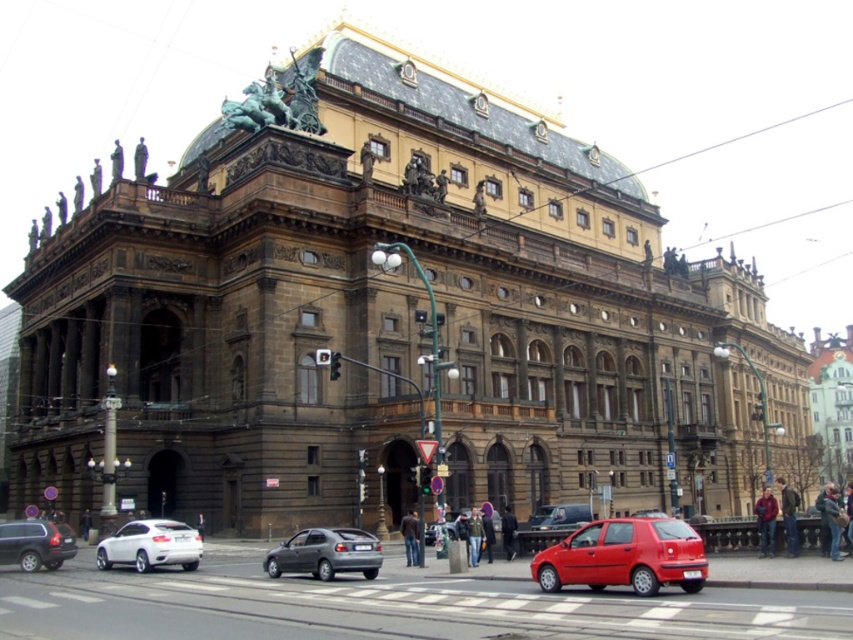
Question: Does matte black car at center appear under dark brown leather jacket at center?

Choices:
 (A) no
 (B) yes

Answer: (A)

Question: Which point is closer to the camera?

Choices:
 (A) click(x=67, y=536)
 (B) click(x=418, y=560)
 (C) click(x=544, y=563)

Answer: (C)

Question: Is matte black suv at lower left thinner than dark blue jacket at center?

Choices:
 (A) yes
 (B) no

Answer: (A)

Question: Observing the image, what is the correct spatial positioning of metallic gray hatchback at lower left in reference to dark brown leather jacket at center?

Choices:
 (A) left
 (B) right

Answer: (A)

Question: Which of the following is the closest to the observer?

Choices:
 (A) metallic gray hatchback at lower left
 (B) matte black car at center
 (C) khaki fabric jacket at center

Answer: (A)

Question: Based on their relative distances, which object is farther from the jeans at center?

Choices:
 (A) matte black suv at lower left
 (B) dark gray jacket at center

Answer: (B)